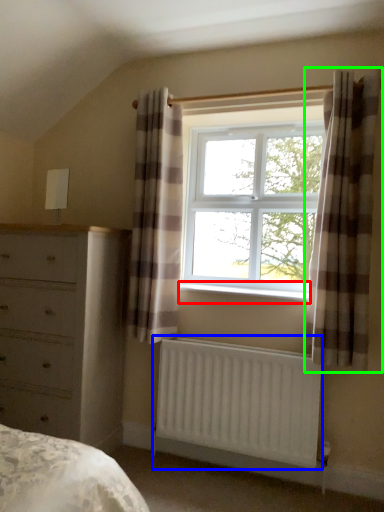
Question: Which object is the farthest from window sill (highlighted by a red box)? Choose among these: radiator (highlighted by a blue box) or curtain (highlighted by a green box).

Choices:
 (A) radiator
 (B) curtain

Answer: (A)